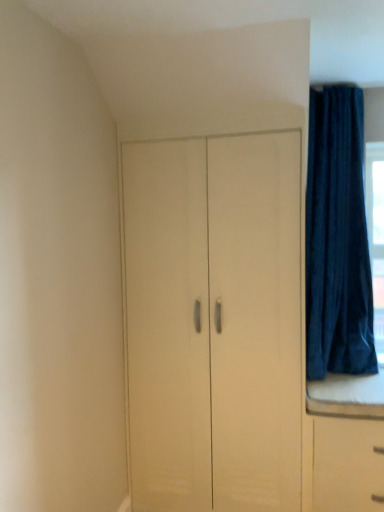
Question: From a real-world perspective, is matte white cupboard at center below dark blue velvet curtain at upper right?

Choices:
 (A) no
 (B) yes

Answer: (B)

Question: Is dark blue velvet curtain at upper right at the back of matte white cupboard at center?

Choices:
 (A) yes
 (B) no

Answer: (B)

Question: From a real-world perspective, is matte white cupboard at center on dark blue velvet curtain at upper right?

Choices:
 (A) yes
 (B) no

Answer: (B)

Question: Considering the relative sizes of matte white cupboard at center and dark blue velvet curtain at upper right in the image provided, is matte white cupboard at center shorter than dark blue velvet curtain at upper right?

Choices:
 (A) no
 (B) yes

Answer: (A)

Question: Is matte white cupboard at center not within dark blue velvet curtain at upper right?

Choices:
 (A) yes
 (B) no

Answer: (A)

Question: Is matte white cupboard at center at the right side of dark blue velvet curtain at upper right?

Choices:
 (A) no
 (B) yes

Answer: (A)

Question: From the image's perspective, is dark blue velvet curtain at upper right below matte white cupboard at center?

Choices:
 (A) yes
 (B) no

Answer: (B)

Question: Is dark blue velvet curtain at upper right aimed at matte white cupboard at center?

Choices:
 (A) no
 (B) yes

Answer: (A)

Question: From a real-world perspective, is dark blue velvet curtain at upper right on matte white cupboard at center?

Choices:
 (A) no
 (B) yes

Answer: (B)

Question: From the image's perspective, is dark blue velvet curtain at upper right on matte white cupboard at center?

Choices:
 (A) no
 (B) yes

Answer: (B)

Question: Is dark blue velvet curtain at upper right completely or partially outside of matte white cupboard at center?

Choices:
 (A) no
 (B) yes

Answer: (B)

Question: Is dark blue velvet curtain at upper right in contact with matte white cupboard at center?

Choices:
 (A) yes
 (B) no

Answer: (B)

Question: Which is correct: matte white cupboard at center is inside dark blue velvet curtain at upper right, or outside of it?

Choices:
 (A) inside
 (B) outside

Answer: (B)